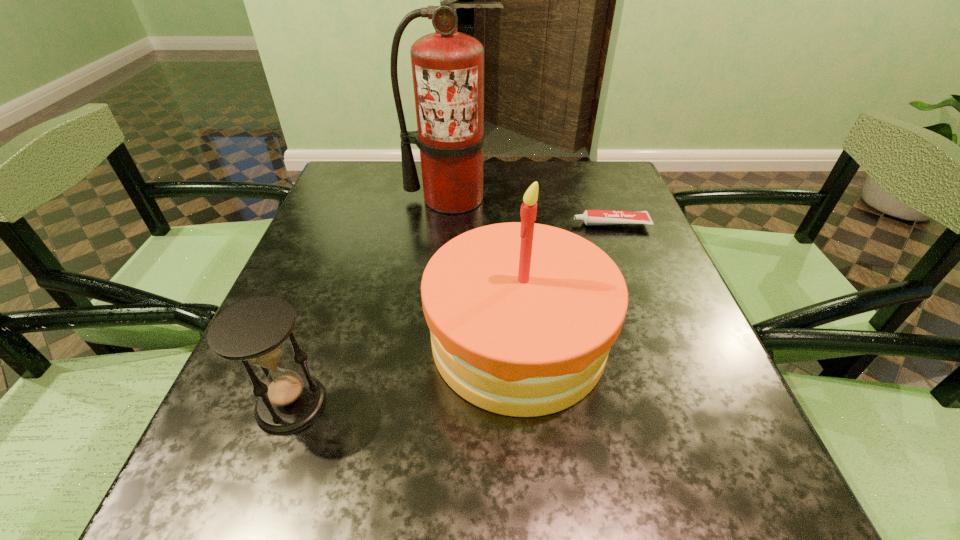
Image resolution: width=960 pixels, height=540 pixels. I want to click on the farthest object, so click(x=447, y=66).

Image resolution: width=960 pixels, height=540 pixels. In order to click on the tallest object in this screenshot , I will do `click(447, 66)`.

Image resolution: width=960 pixels, height=540 pixels. What are the coordinates of `the second tallest object` in the screenshot? It's located at (522, 316).

At what (x,y) coordinates should I click in order to perform the action: click on the leftmost object. Please return your answer as a coordinate pair (x, y). Image resolution: width=960 pixels, height=540 pixels. Looking at the image, I should click on (254, 330).

This screenshot has width=960, height=540. What are the coordinates of `the second shortest object` in the screenshot? It's located at (254, 330).

Locate an element on the screen. The width and height of the screenshot is (960, 540). toothpaste is located at coordinates (590, 217).

Identify the location of the third nearest object. Image resolution: width=960 pixels, height=540 pixels. (590, 217).

Find the location of a particular element. vacant space located 0.070m toward the nozzle of the farthest object is located at coordinates [x=448, y=233].

At what (x,y) coordinates should I click in order to perform the action: click on vacant space located on the left of the birthday cake. Please return your answer as a coordinate pair (x, y). This screenshot has height=540, width=960. Looking at the image, I should click on (395, 340).

Identify the location of free space located on the right of the second shortest object. Image resolution: width=960 pixels, height=540 pixels. (389, 404).